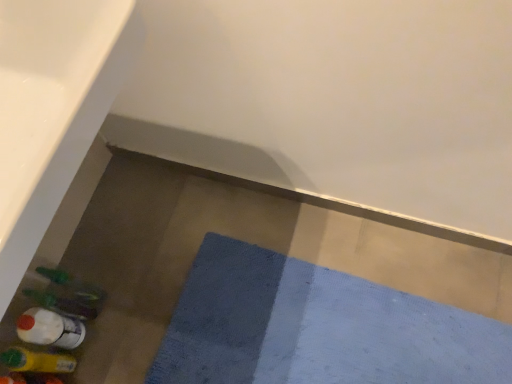
In order to click on vacant region below white glossy bath at lower left (from a real-world perspective) in this screenshot , I will do `click(140, 269)`.